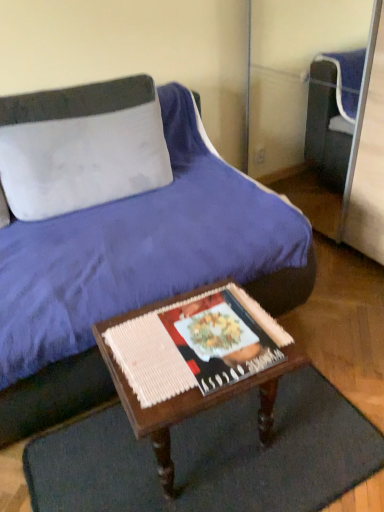
This screenshot has width=384, height=512. Identify the location of vacant space situated above matte paper magazine at center (from a real-world perspective). (220, 332).